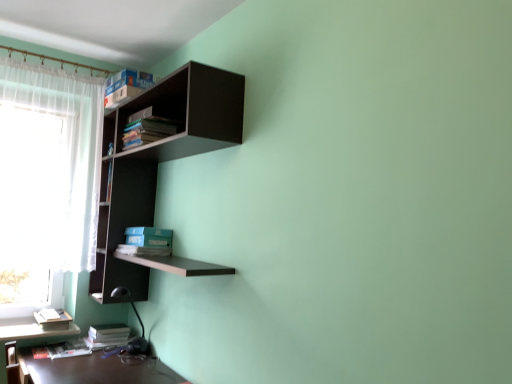
Question: Is blue matte bookshelf at center, the second book viewed from the top, inside the boundaries of white sheer curtain at left, or outside?

Choices:
 (A) outside
 (B) inside

Answer: (A)

Question: Relative to white sheer curtain at left, is blue matte bookshelf at center, the 4th book positioned from the bottom, in front or behind?

Choices:
 (A) front
 (B) behind

Answer: (B)

Question: Which of these objects is positioned farthest from the dark wood shelf at upper left?

Choices:
 (A) blue matte bookshelf at center, the 4th book positioned from the bottom
 (B) matte black book at upper center, the 1th book in the top-to-bottom sequence
 (C) hardcover book at lower left, the fifth book viewed from the top
 (D) white sheer curtain at left
 (E) hardcover book at lower left, the 2th book in the bottom-to-top sequence

Answer: (C)

Question: Which is farther from the brown wooden table at lower left?

Choices:
 (A) white sheer curtain at left
 (B) hardcover book at lower left, the 2th book in the bottom-to-top sequence
 (C) matte black book at upper center, which is the fifth book in bottom-to-top order
 (D) blue matte bookshelf at center, the second book viewed from the top
 (E) white paper book at lower left, marked as the 3th book in a top-to-bottom arrangement

Answer: (C)